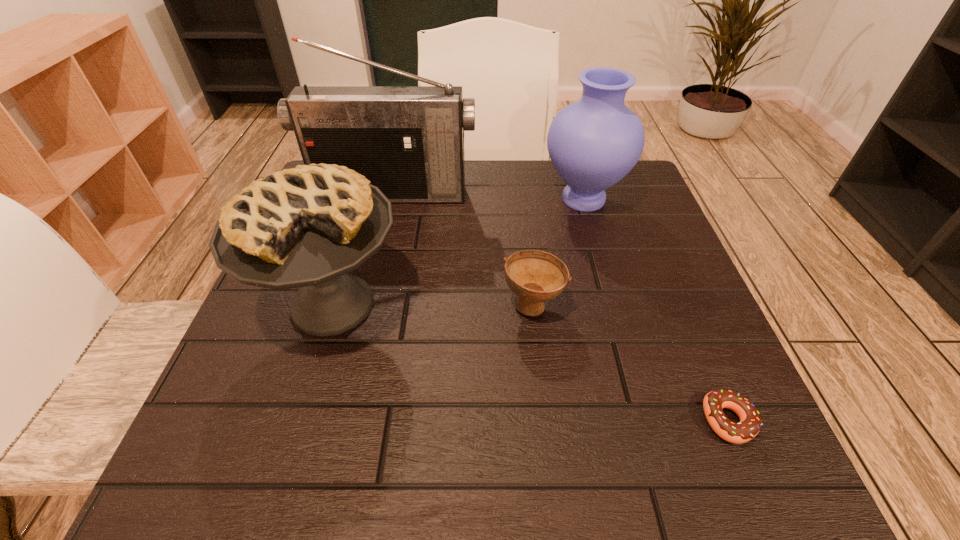
Image resolution: width=960 pixels, height=540 pixels. Find the location of `vacant space that satisfies the following two spatial constraints: 1. on the front-facing side of the tallest object; 2. on the left side of the second shortest object`. vacant space that satisfies the following two spatial constraints: 1. on the front-facing side of the tallest object; 2. on the left side of the second shortest object is located at coordinates (366, 304).